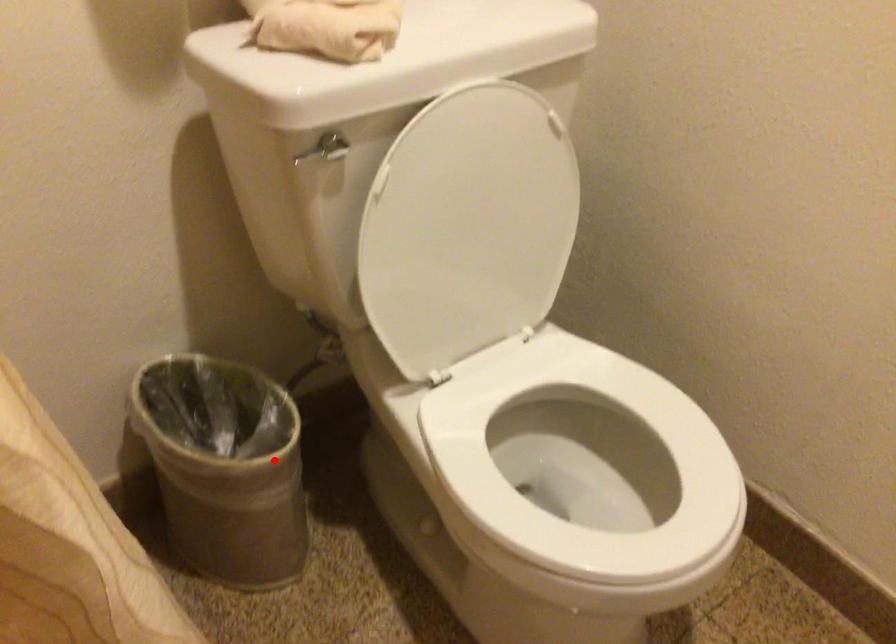
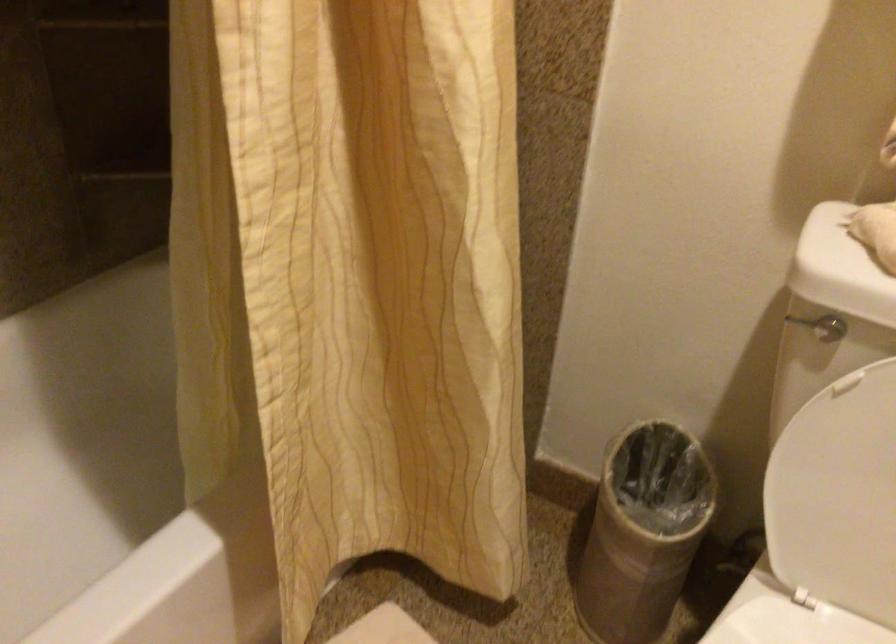
Question: I am providing you with two images of the same scene from different viewpoints. Image1 has a red point marked. In image2, the corresponding 3D location appears at what relative position? Reply with the corresponding letter.

Choices:
 (A) Closer
 (B) Farther

Answer: (B)